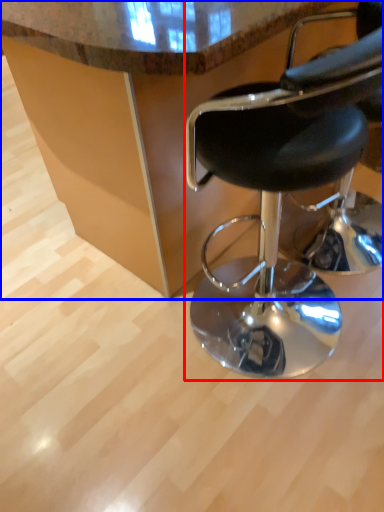
Question: Which of the following is the farthest to the observer, chair (highlighted by a red box) or table (highlighted by a blue box)?

Choices:
 (A) chair
 (B) table

Answer: (B)